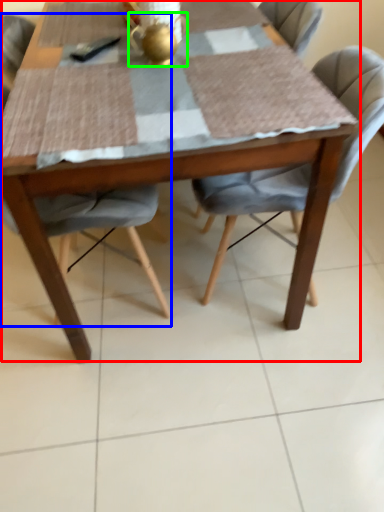
Question: Based on their relative distances, which object is nearer to kitchen & dining room table (highlighted by a red box)? Choose from chair (highlighted by a blue box) and tea pot (highlighted by a green box).

Choices:
 (A) chair
 (B) tea pot

Answer: (B)